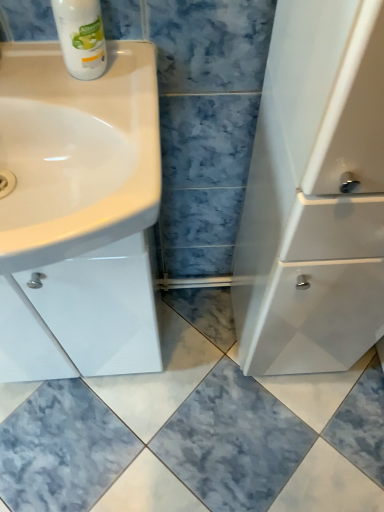
The width and height of the screenshot is (384, 512). I want to click on free space to the left of white glossy bottle at upper left, so click(28, 73).